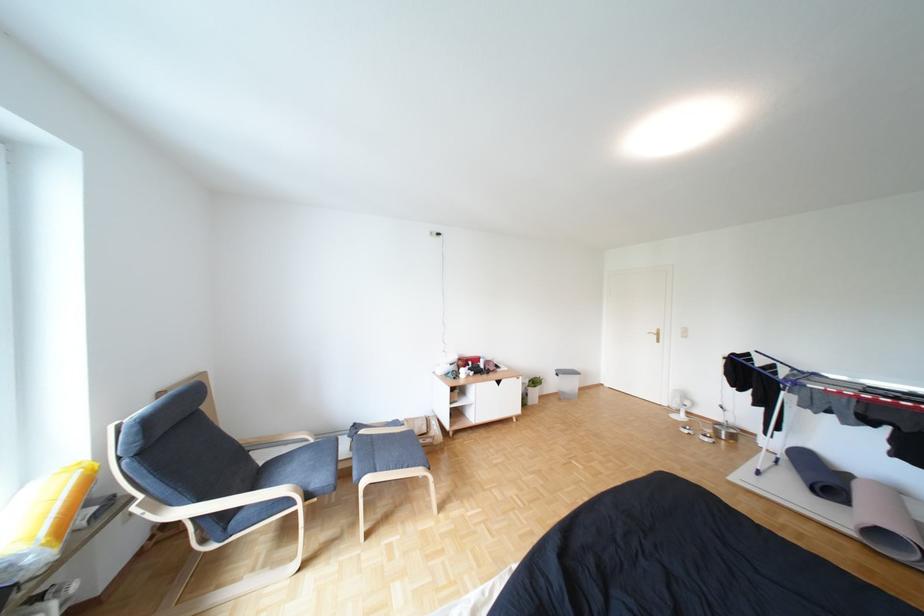
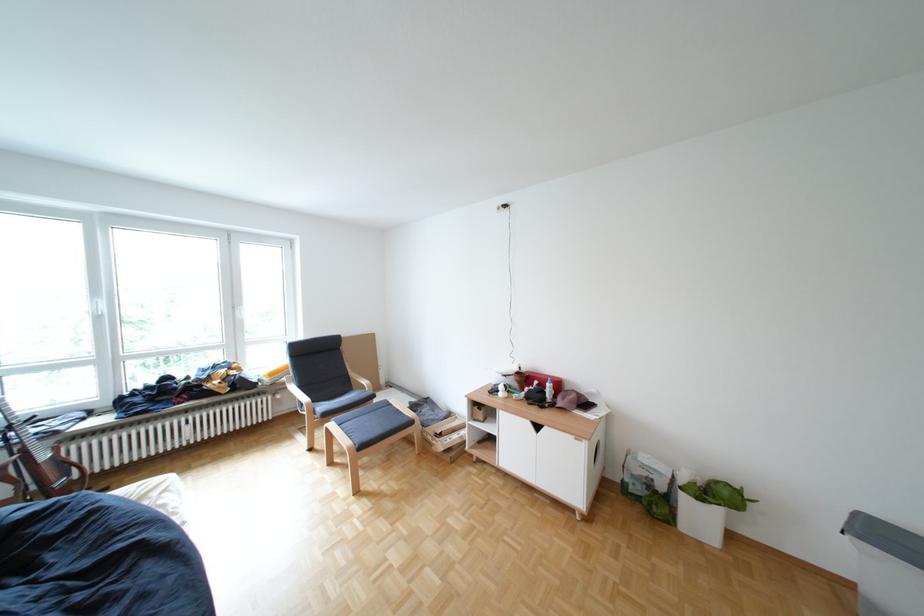
Find the pixel in the second image that matches [485,363] in the first image.

(552, 383)